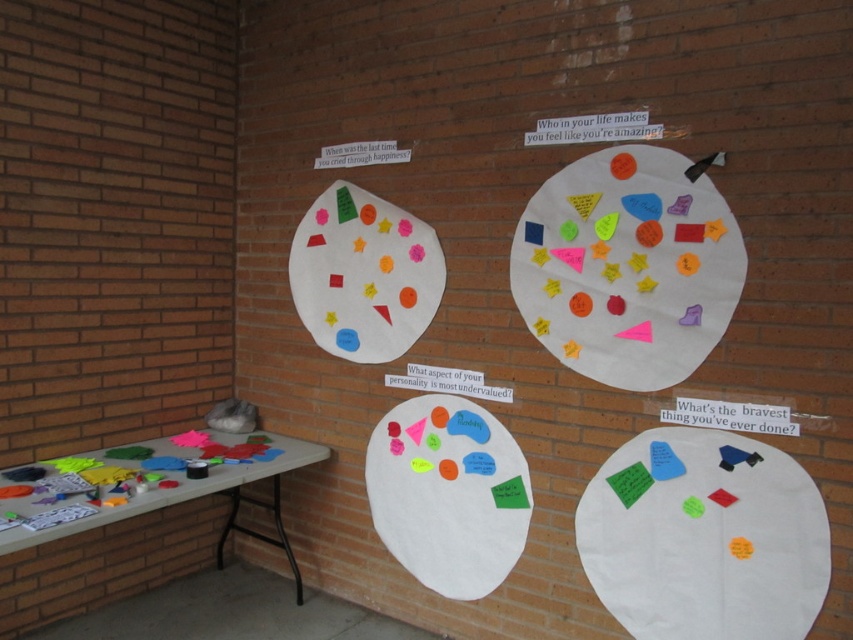
You are organizing a community art event and need to arrange materials. You have a white matte paper plate at lower right and matte felt shapes at center. Which object is located to the right of the other?

The white matte paper plate at lower right is positioned on the right side of matte felt shapes at center.

You are organizing a workshop and need to place a white matte paper plate at center on the smooth gray table at lower left. Given their sizes, will the paper plate fit entirely on the table without overhanging?

The smooth gray table at lower left is larger in size than the white matte paper plate at center, so yes, the paper plate will fit entirely on the table without overhanging.

You are a photographer who needs to set up a camera 6 feet away from a smooth gray table at lower left. Based on the scene, is the camera already positioned correctly?

The smooth gray table at lower left and camera are 6.35 feet apart, so the camera is positioned correctly since 6.35 feet is just slightly more than 6 feet.